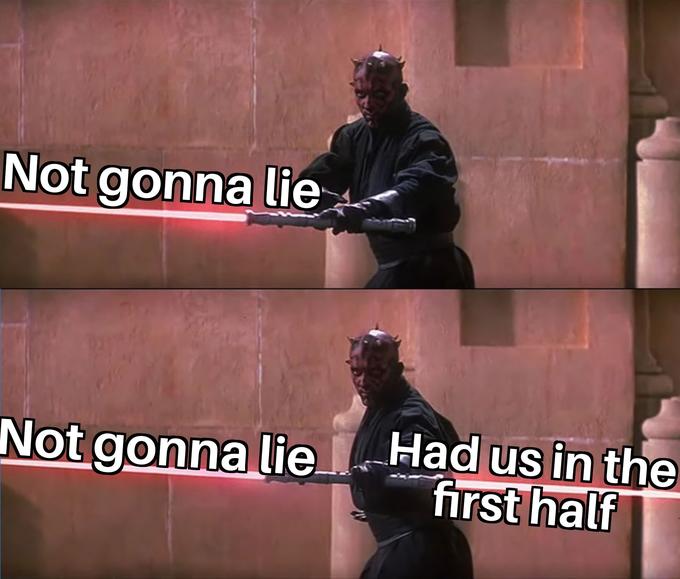
Locate an element on the screen. The width and height of the screenshot is (680, 579). top panel is located at coordinates (530, 108).